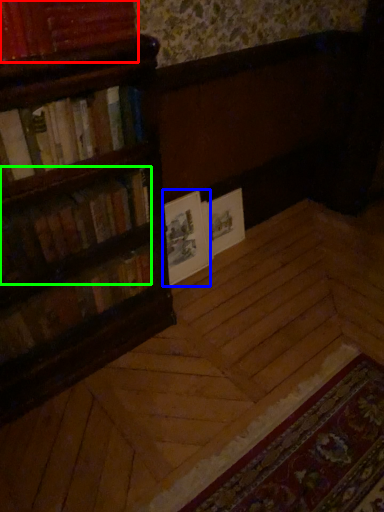
Question: Which is nearer to the book (highlighted by a red box)? paperback book (highlighted by a blue box) or book (highlighted by a green box).

Choices:
 (A) paperback book
 (B) book

Answer: (B)